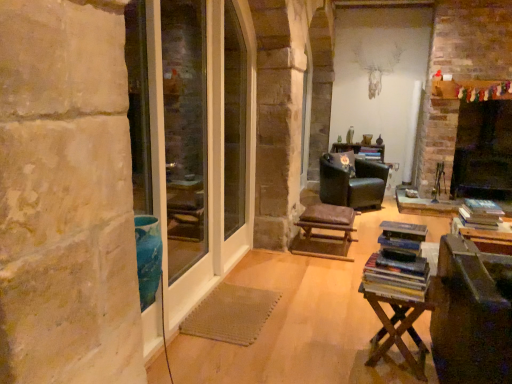
The height and width of the screenshot is (384, 512). Find the location of `vacant space behind wooden table at lower right`. vacant space behind wooden table at lower right is located at coordinates (351, 323).